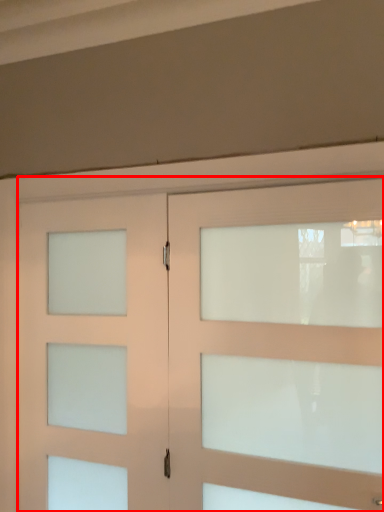
Question: In this image, where is door (annotated by the red box) located relative to door?

Choices:
 (A) right
 (B) left

Answer: (A)